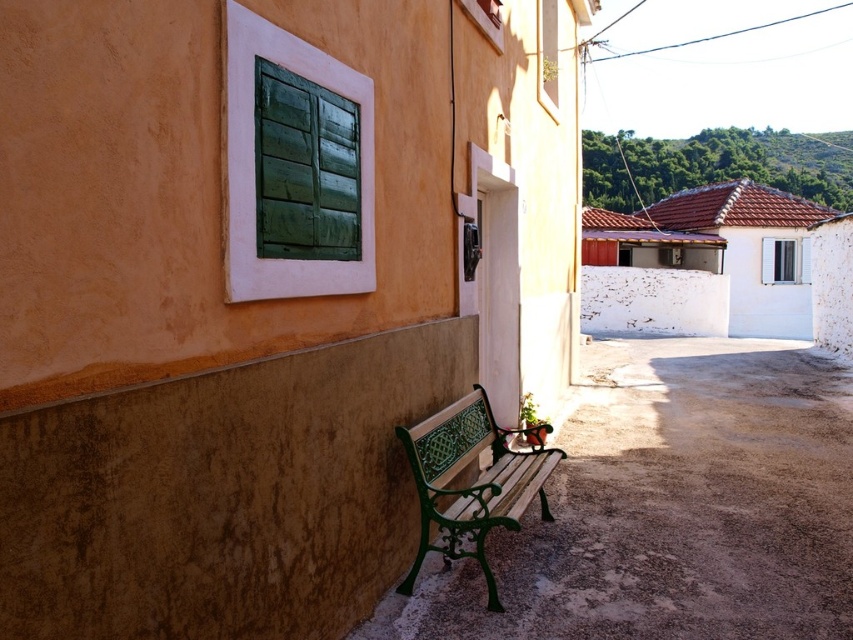
Question: Can you confirm if green painted wood bench at lower center is smaller than green wrought iron bench at lower center?

Choices:
 (A) yes
 (B) no

Answer: (B)

Question: Is green painted wood bench at lower center above green wrought iron bench at lower center?

Choices:
 (A) no
 (B) yes

Answer: (A)

Question: Which point is closer to the camera?

Choices:
 (A) green wrought iron bench at lower center
 (B) green painted wood bench at lower center

Answer: (B)

Question: Is green painted wood bench at lower center smaller than green wrought iron bench at lower center?

Choices:
 (A) yes
 (B) no

Answer: (B)

Question: Which of the following is the farthest from the observer?

Choices:
 (A) green wrought iron bench at lower center
 (B) green painted wood bench at lower center

Answer: (A)

Question: Which point is farther to the camera?

Choices:
 (A) green painted wood bench at lower center
 (B) green wrought iron bench at lower center

Answer: (B)